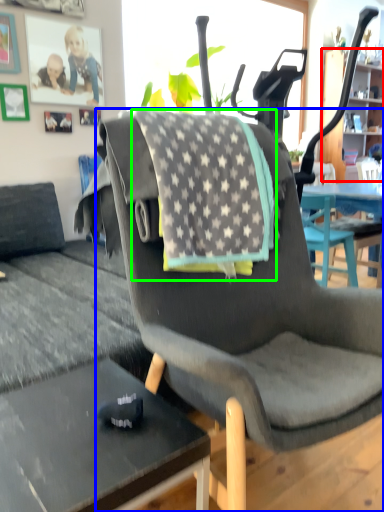
Question: Estimate the real-world distances between objects in this image. Which object is farther from cabinetry (highlighted by a red box), chair (highlighted by a blue box) or blanket (highlighted by a green box)?

Choices:
 (A) chair
 (B) blanket

Answer: (A)